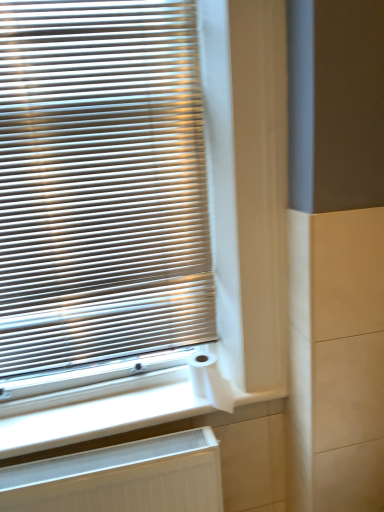
Question: Does matte silver blinds at left have a greater width compared to white ribbed radiator at lower left?

Choices:
 (A) no
 (B) yes

Answer: (A)

Question: Is matte silver blinds at left located outside white ribbed radiator at lower left?

Choices:
 (A) yes
 (B) no

Answer: (A)

Question: Considering the relative sizes of matte silver blinds at left and white ribbed radiator at lower left in the image provided, is matte silver blinds at left thinner than white ribbed radiator at lower left?

Choices:
 (A) no
 (B) yes

Answer: (B)

Question: Is matte silver blinds at left facing away from white ribbed radiator at lower left?

Choices:
 (A) yes
 (B) no

Answer: (B)

Question: Considering the relative sizes of matte silver blinds at left and white ribbed radiator at lower left in the image provided, is matte silver blinds at left smaller than white ribbed radiator at lower left?

Choices:
 (A) yes
 (B) no

Answer: (B)

Question: In terms of height, does matte silver blinds at left look taller or shorter compared to white matte toilet paper at lower center?

Choices:
 (A) short
 (B) tall

Answer: (B)

Question: From the image's perspective, relative to white matte toilet paper at lower center, is matte silver blinds at left above or below?

Choices:
 (A) above
 (B) below

Answer: (A)

Question: From a real-world perspective, relative to white matte toilet paper at lower center, is matte silver blinds at left vertically above or below?

Choices:
 (A) above
 (B) below

Answer: (A)

Question: Is point (11, 234) positioned closer to the camera than point (218, 404)?

Choices:
 (A) closer
 (B) farther

Answer: (A)

Question: Is point (210, 382) closer or farther from the camera than point (94, 460)?

Choices:
 (A) farther
 (B) closer

Answer: (A)

Question: Is white matte toilet paper at lower center taller or shorter than white ribbed radiator at lower left?

Choices:
 (A) short
 (B) tall

Answer: (A)

Question: In the image, is white matte toilet paper at lower center positioned in front of or behind white ribbed radiator at lower left?

Choices:
 (A) behind
 (B) front

Answer: (A)

Question: From the image's perspective, is white matte toilet paper at lower center located above or below white ribbed radiator at lower left?

Choices:
 (A) below
 (B) above

Answer: (B)

Question: In terms of width, does white matte toilet paper at lower center look wider or thinner when compared to matte silver blinds at left?

Choices:
 (A) thin
 (B) wide

Answer: (B)

Question: Considering the positions of white matte toilet paper at lower center and matte silver blinds at left in the image, is white matte toilet paper at lower center taller or shorter than matte silver blinds at left?

Choices:
 (A) short
 (B) tall

Answer: (A)